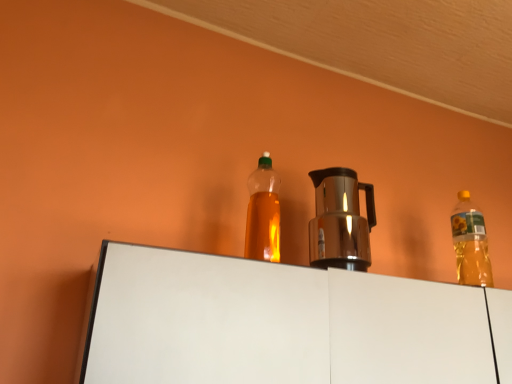
Question: Is translucent plastic bottle at upper right, the 2th bottle viewed from the front, not inside translucent plastic bottle at center, the second bottle when ordered from right to left?

Choices:
 (A) yes
 (B) no

Answer: (A)

Question: From a real-world perspective, does translucent plastic bottle at upper right, the 2th bottle viewed from the front, stand above translucent plastic bottle at center, the 1th bottle when ordered from front to back?

Choices:
 (A) yes
 (B) no

Answer: (A)

Question: Is translucent plastic bottle at upper right, the first bottle when ordered from right to left, in front of translucent plastic bottle at center, the second bottle when ordered from right to left?

Choices:
 (A) yes
 (B) no

Answer: (B)

Question: From a real-world perspective, is translucent plastic bottle at upper right, the 2th bottle viewed from the front, under translucent plastic bottle at center, the second bottle when ordered from right to left?

Choices:
 (A) yes
 (B) no

Answer: (B)

Question: Are translucent plastic bottle at upper right, the 1th bottle from the back, and translucent plastic bottle at center, the first bottle from the left, far apart?

Choices:
 (A) no
 (B) yes

Answer: (A)

Question: From the image's perspective, is shiny metallic coffee pot at center located above or below translucent plastic bottle at center, the second bottle when ordered from right to left?

Choices:
 (A) above
 (B) below

Answer: (B)

Question: From a real-world perspective, is shiny metallic coffee pot at center physically located above or below translucent plastic bottle at center, which is the 2th bottle from back to front?

Choices:
 (A) above
 (B) below

Answer: (B)

Question: From their relative heights in the image, would you say shiny metallic coffee pot at center is taller or shorter than translucent plastic bottle at center, which is the 2th bottle from back to front?

Choices:
 (A) tall
 (B) short

Answer: (B)

Question: Is shiny metallic coffee pot at center wider or thinner than translucent plastic bottle at center, the first bottle from the left?

Choices:
 (A) thin
 (B) wide

Answer: (B)

Question: Is translucent plastic bottle at center, which is the 2th bottle from back to front, in front of or behind translucent plastic bottle at upper right, the 2th bottle viewed from the front, in the image?

Choices:
 (A) behind
 (B) front

Answer: (B)

Question: From a real-world perspective, is translucent plastic bottle at center, the first bottle from the left, physically located above or below translucent plastic bottle at upper right, the 1th bottle from the back?

Choices:
 (A) below
 (B) above

Answer: (A)

Question: Is point (266, 221) positioned closer to the camera than point (453, 215)?

Choices:
 (A) closer
 (B) farther

Answer: (A)

Question: Looking at their shapes, would you say translucent plastic bottle at center, the first bottle from the left, is wider or thinner than translucent plastic bottle at upper right, the 1th bottle from the back?

Choices:
 (A) thin
 (B) wide

Answer: (B)

Question: From a real-world perspective, relative to shiny metallic coffee pot at center, is translucent plastic bottle at upper right, the 1th bottle from the back, vertically above or below?

Choices:
 (A) below
 (B) above

Answer: (B)

Question: In the image, is translucent plastic bottle at upper right, the 2th bottle when ordered from left to right, positioned in front of or behind shiny metallic coffee pot at center?

Choices:
 (A) front
 (B) behind

Answer: (B)